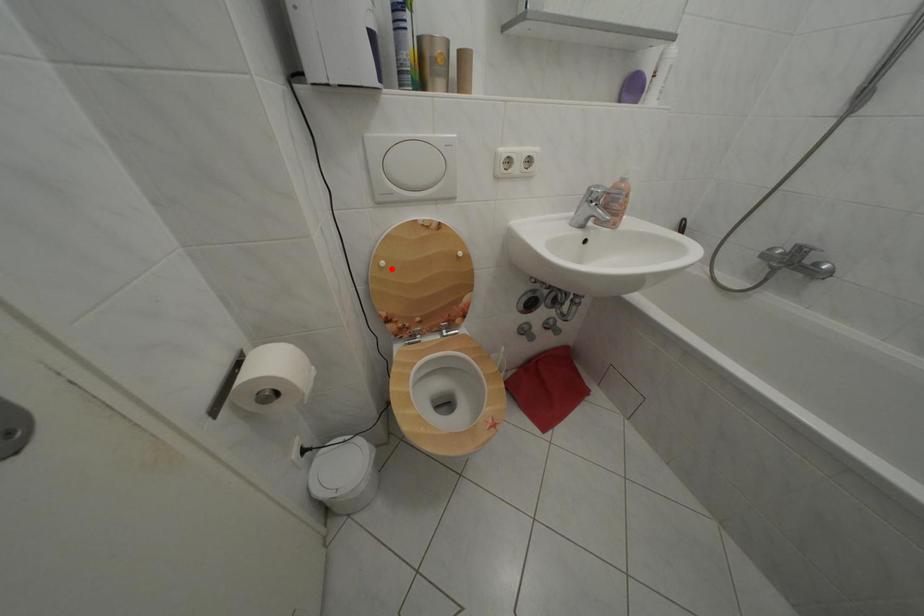
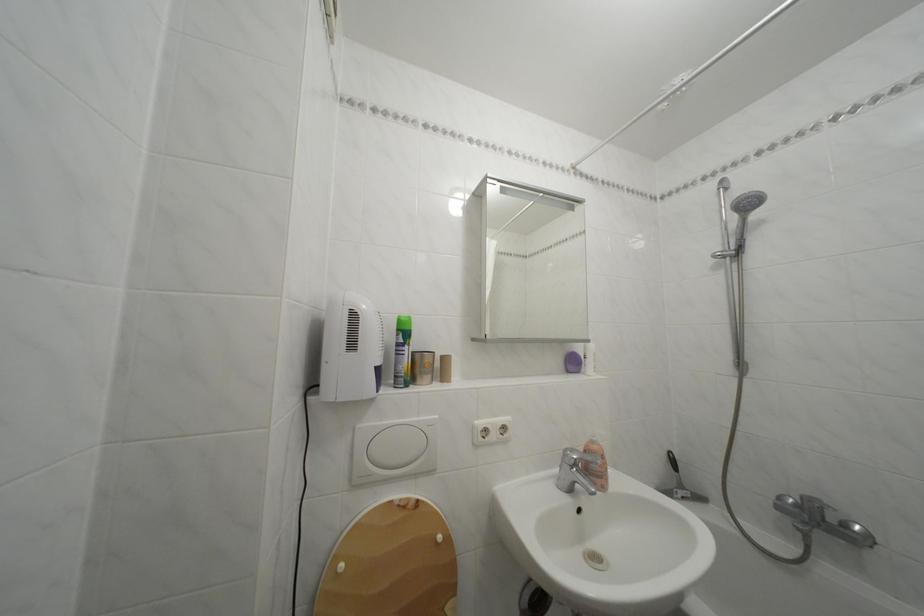
Find the pixel in the second image that matches the highlighted location in the first image.

(350, 573)